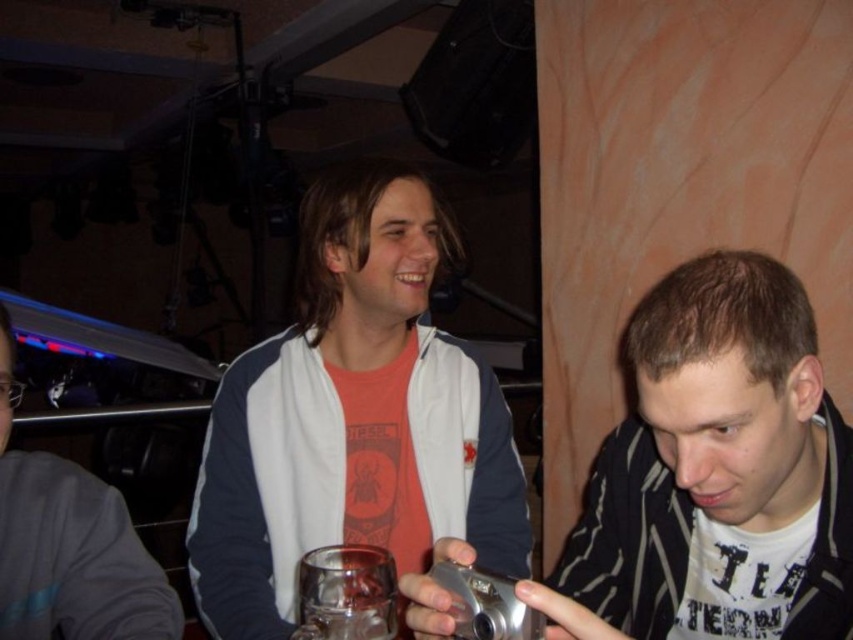
Based on the photo, which of these two, brushed metal camera at center or translucent glass at center, stands taller?

With more height is brushed metal camera at center.

Is brushed metal camera at center thinner than translucent glass at center?

In fact, brushed metal camera at center might be wider than translucent glass at center.

Between point (79, 512) and point (349, 605), which one is positioned in front?

Positioned in front is point (349, 605).

I want to click on brushed metal camera at center, so tap(68, 545).

Does point (280, 381) come farther from viewer compared to point (701, 326)?

Yes, point (280, 381) is farther from viewer.

The height and width of the screenshot is (640, 853). Identify the location of white matte jacket at center. (352, 417).

Is white matte jacket at center taller than translucent glass at center?

→ Yes.

The height and width of the screenshot is (640, 853). I want to click on white matte jacket at center, so click(x=352, y=417).

Does point (264, 548) come in front of point (346, 577)?

That is False.

Where is `white matte jacket at center`? The height and width of the screenshot is (640, 853). white matte jacket at center is located at coordinates (352, 417).